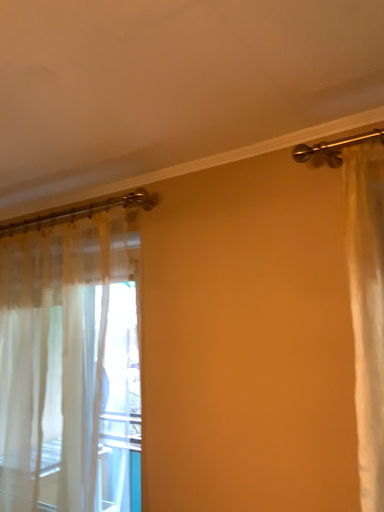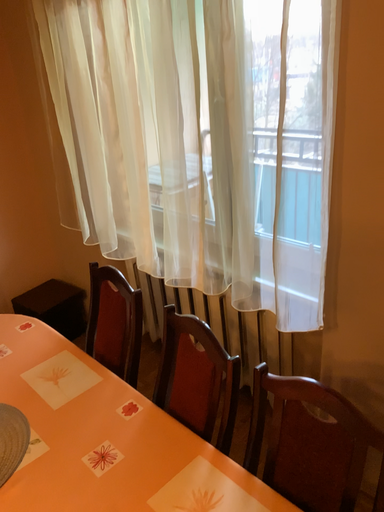
Question: Which way did the camera rotate in the video?

Choices:
 (A) rotated left
 (B) rotated right

Answer: (A)